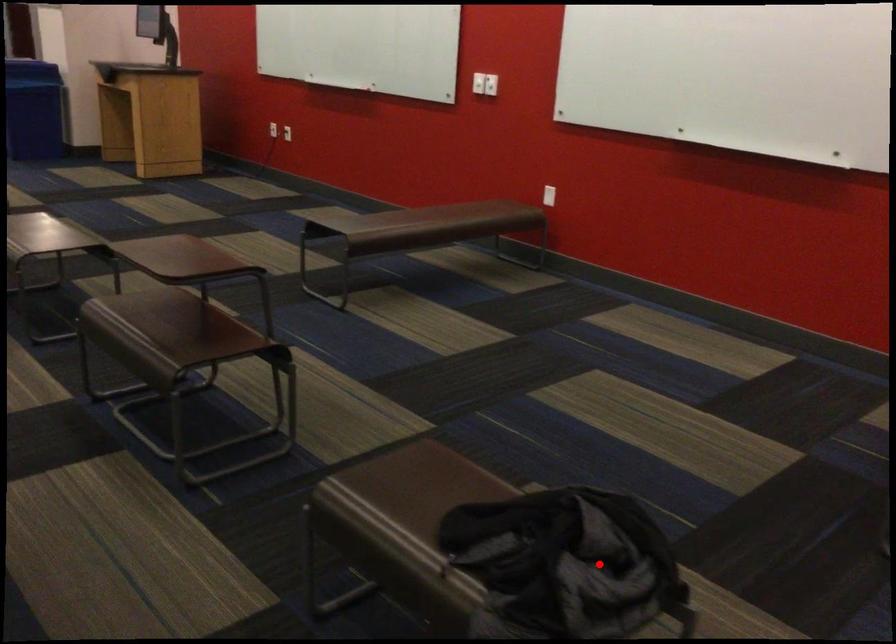
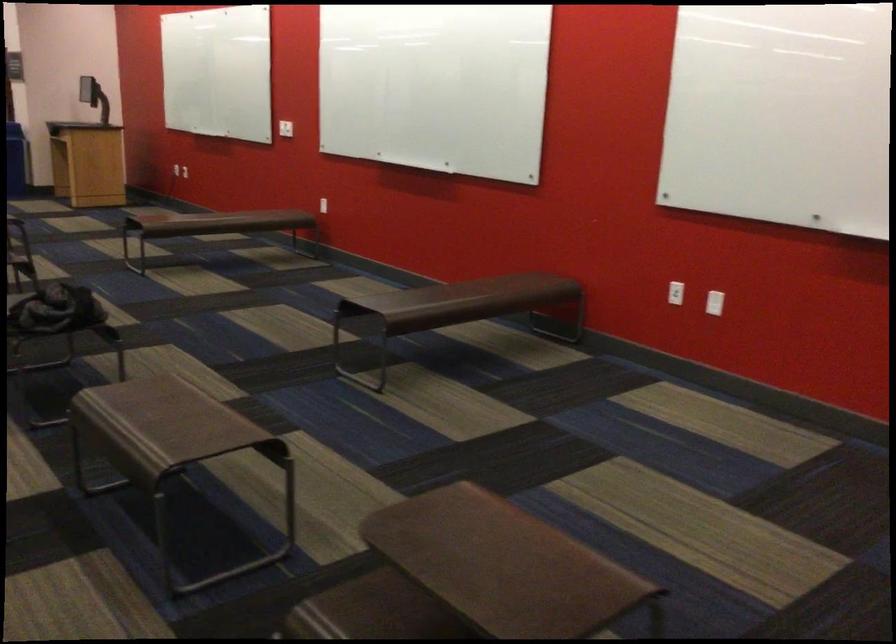
Question: I am providing you with two images of the same scene from different viewpoints. In image1, a red point is highlighted. Considering the same 3D point in image2, which of the following is correct?

Choices:
 (A) It is closer
 (B) It is farther

Answer: (B)